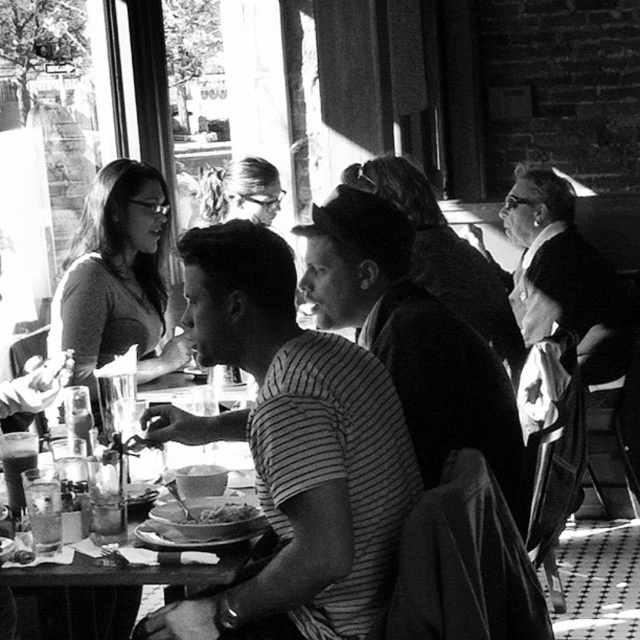
You are standing in the dining establishment and want to locate the striped fabric shirt at center. According to the coordinates provided, in which direction should you look relative to your current position?

You should look towards the coordinates point at 0.700 on the x axis and 0.458 on the y axis to locate the striped fabric shirt at center.

You are a photographer standing in the dining area and want to take a photo of both the striped fabric shirt at center and the smooth brown bread at center. Which object should you focus on first to ensure both are in focus?

The striped fabric shirt at center is in front of the smooth brown bread at center, so you should focus on the striped fabric shirt at center first to ensure both are in focus.